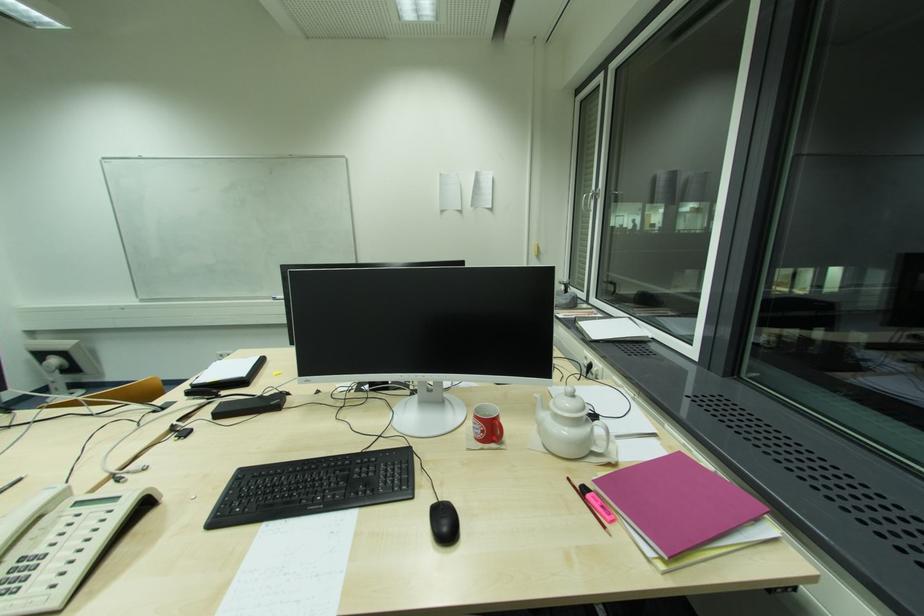
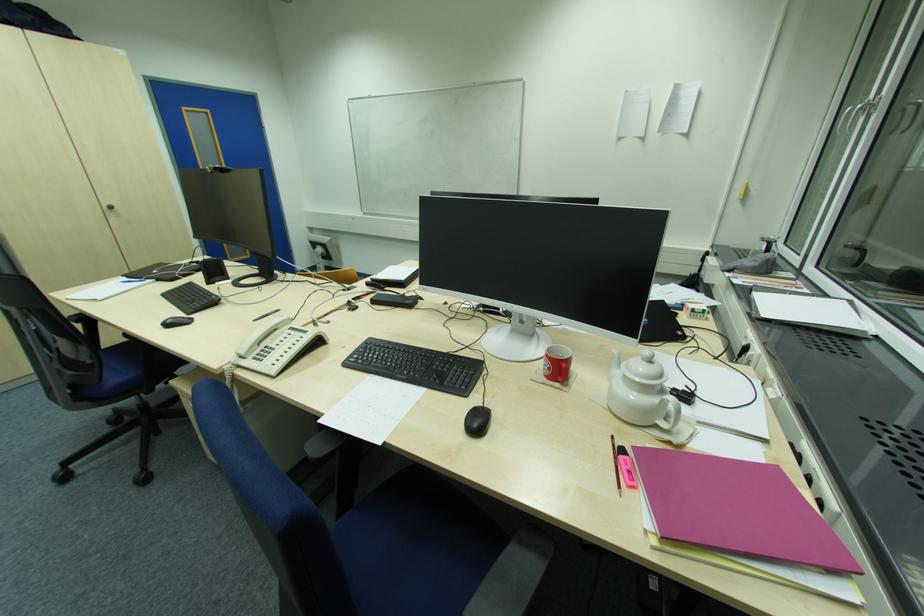
Where in the second image is the point corresponding to [587,197] from the first image?

(850, 111)